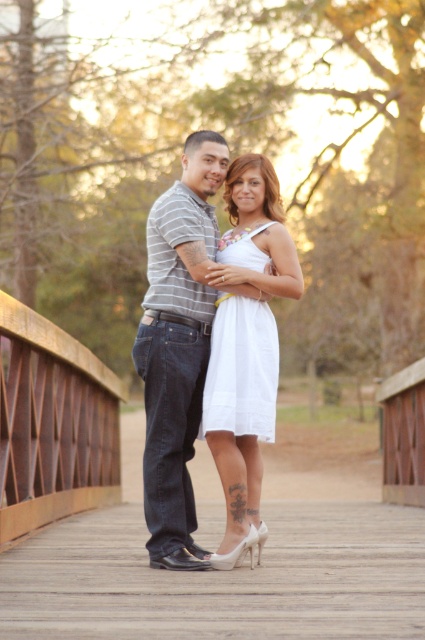
Question: Can you confirm if white satin dress at center is positioned to the right of white sheer dress at center?

Choices:
 (A) yes
 (B) no

Answer: (A)

Question: Is the position of striped cotton shirt at center more distant than that of brown wooden bridge at lower left?

Choices:
 (A) yes
 (B) no

Answer: (B)

Question: Which point is farther to the camera?

Choices:
 (A) white sheer dress at center
 (B) brown wooden bridge at lower left
 (C) white satin dress at center
 (D) striped cotton shirt at center

Answer: (B)

Question: Among these points, which one is farthest from the camera?

Choices:
 (A) (48, 417)
 (B) (268, 330)
 (C) (150, 476)
 (D) (266, 406)

Answer: (A)

Question: From the image, what is the correct spatial relationship of striped cotton shirt at center in relation to brown wooden bridge at lower left?

Choices:
 (A) left
 (B) right

Answer: (B)

Question: Which object is closer to the camera taking this photo?

Choices:
 (A) brown wooden bridge at lower left
 (B) white satin dress at center

Answer: (B)